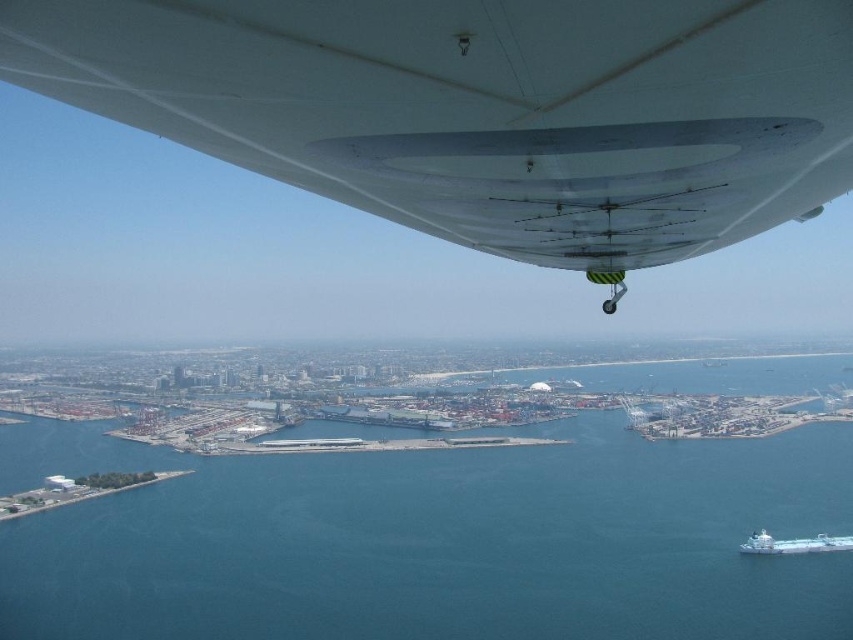
Does blue water at center have a lesser width compared to white glossy boat at lower right?

No.

Is point (389, 625) closer to camera compared to point (741, 550)?

That is True.

The image size is (853, 640). What do you see at coordinates (433, 540) in the screenshot?
I see `blue water at center` at bounding box center [433, 540].

Find the location of a particular element. The width and height of the screenshot is (853, 640). blue water at center is located at coordinates (433, 540).

Which is more to the left, white matte wing at upper center or white glossy boat at lower right?

From the viewer's perspective, white matte wing at upper center appears more on the left side.

Looking at this image, can you confirm if white matte wing at upper center is bigger than white glossy boat at lower right?

Correct, white matte wing at upper center is larger in size than white glossy boat at lower right.

Find the location of a particular element. This screenshot has height=640, width=853. white matte wing at upper center is located at coordinates (483, 109).

Image resolution: width=853 pixels, height=640 pixels. I want to click on white matte wing at upper center, so click(483, 109).

At what (x,y) coordinates should I click in order to perform the action: click on white matte wing at upper center. Please return your answer as a coordinate pair (x, y). The image size is (853, 640). Looking at the image, I should click on (483, 109).

Who is shorter, white matte wing at upper center or blue water at center?

Standing shorter between the two is white matte wing at upper center.

Who is more forward, (328,148) or (627,556)?

Positioned in front is point (328,148).

This screenshot has width=853, height=640. I want to click on white matte wing at upper center, so click(483, 109).